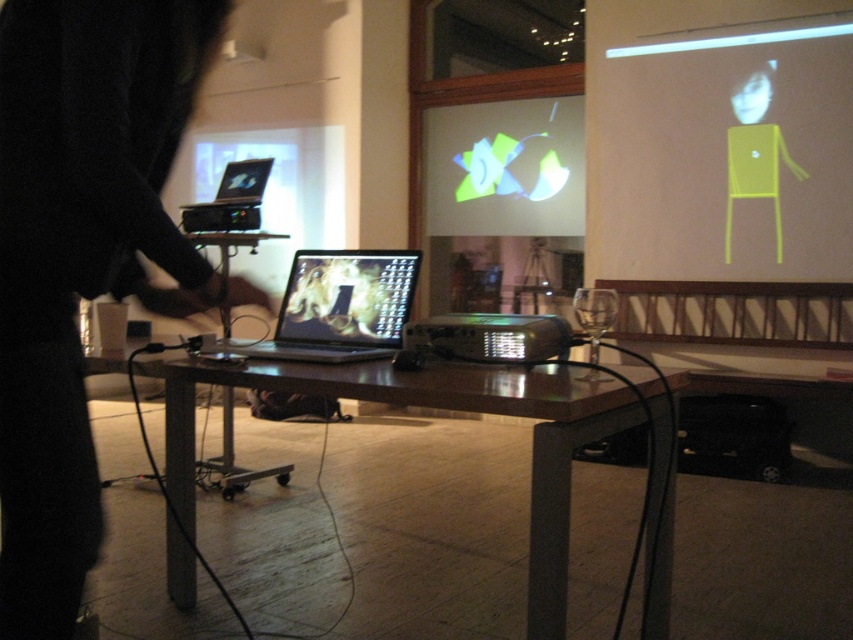
Question: Can you confirm if shiny metallic laptop at center is positioned to the right of black plastic projector at center?

Choices:
 (A) yes
 (B) no

Answer: (B)

Question: Which point appears farthest from the camera in this image?

Choices:
 (A) (666, 522)
 (B) (447, 349)
 (C) (430, 152)
 (D) (227, 13)

Answer: (C)

Question: Does shiny metallic laptop at center appear on the left side of black plastic projector at center?

Choices:
 (A) yes
 (B) no

Answer: (A)

Question: Does black fabric at left lie behind wooden table at center?

Choices:
 (A) no
 (B) yes

Answer: (A)

Question: Which object is closer to the camera taking this photo?

Choices:
 (A) black plastic projector at center
 (B) matte black laptop at upper left
 (C) wooden table at center
 (D) black fabric at left

Answer: (D)

Question: Which point is farther from the camera taking this photo?

Choices:
 (A) (483, 353)
 (B) (299, 269)
 (C) (576, 108)

Answer: (C)